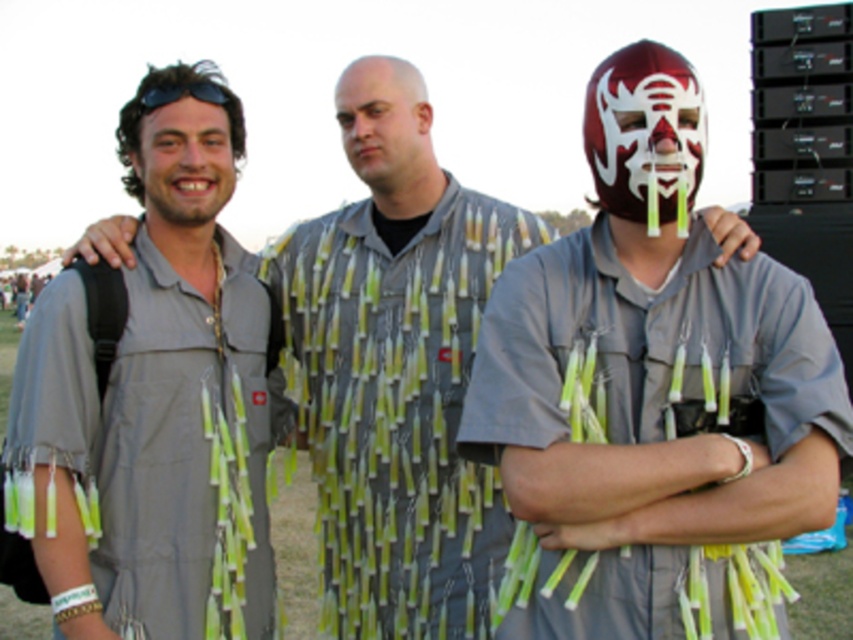
You are a photographer standing at the center of the scene. You need to take a photo of both the matte gray shirt with tassels at center and the gray fabric shirt at left. Given that your camera has a maximum focus range of 2 meters, will both subjects be in focus?

The matte gray shirt with tassels at center is 2.11 meters away from the gray fabric shirt at left. Since the distance between them exceeds the camera maximum focus range of 2 meters, both subjects will not be in focus.

You are standing at the origin point of the coordinate system in the image. The gray fabric shirt at left is located at point (149, 388). If you want to move towards the gray fabric shirt at left, which direction should you move in terms of x and y coordinates?

To move towards the gray fabric shirt at left located at point (149, 388) from the origin, you should move in the positive x and positive y direction.

You are a photographer trying to capture a candid shot of the two subjects in the scene. You notice the smooth bald head at center and the black matte sunglasses at upper left. Which object is positioned lower in the frame?

The smooth bald head at center is located below black matte sunglasses at upper left, so the smooth bald head at center is positioned lower in the frame.